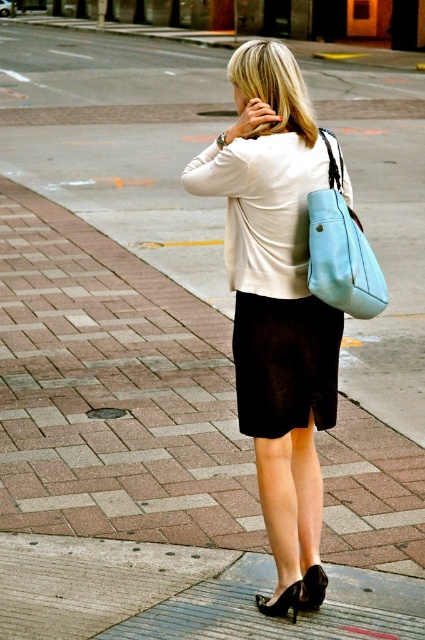
Question: Can you confirm if matte white blouse at center is positioned to the left of light blue leather shoulder bag at right?

Choices:
 (A) no
 (B) yes

Answer: (B)

Question: Which of the following is the closest to the observer?

Choices:
 (A) matte white blouse at center
 (B) light blue leather shoulder bag at right

Answer: (B)

Question: Can you confirm if matte white blouse at center is wider than light blue leather shoulder bag at right?

Choices:
 (A) no
 (B) yes

Answer: (B)

Question: Which point appears farthest from the camera in this image?

Choices:
 (A) (303, 534)
 (B) (354, 232)

Answer: (A)

Question: Does matte white blouse at center appear over light blue leather shoulder bag at right?

Choices:
 (A) yes
 (B) no

Answer: (B)